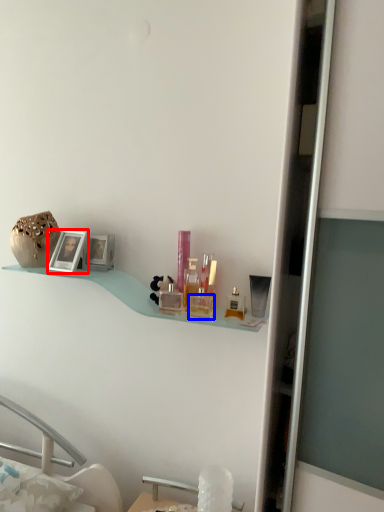
Question: Which object is further to the camera taking this photo, picture frame (highlighted by a red box) or toiletry (highlighted by a blue box)?

Choices:
 (A) picture frame
 (B) toiletry

Answer: (A)